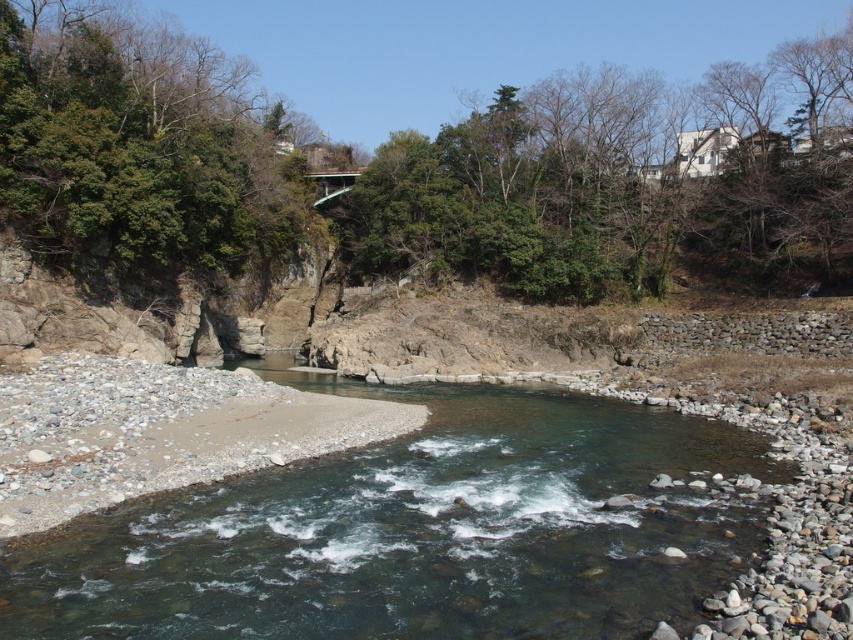
You are a hiker planning to cross the river shown in the image. You notice the clear water at center and the green leafy tree at upper left. Based on their sizes, which one do you think is wider?

The clear water at center is wider than the green leafy tree at upper left according to the description.

You are an environmental scientist assessing the river ecosystem. You observe the clear water at center and the green leafy tree at upper center. Which object occupies a larger area in the image?

The green leafy tree at upper center occupies a larger area in the image than the clear water at center, as stated in the description.

You are standing at the point marked by coordinates point (x=624, y=184) in the image. Looking around, you see a green leafy tree at upper center. Which direction should you face to see the green leafy tree at upper center?

You are already at the point marked by coordinates point (x=624, y=184), which marks the green leafy tree at upper center. Therefore, you are standing at the location of the green leafy tree at upper center and cannot see it from there.